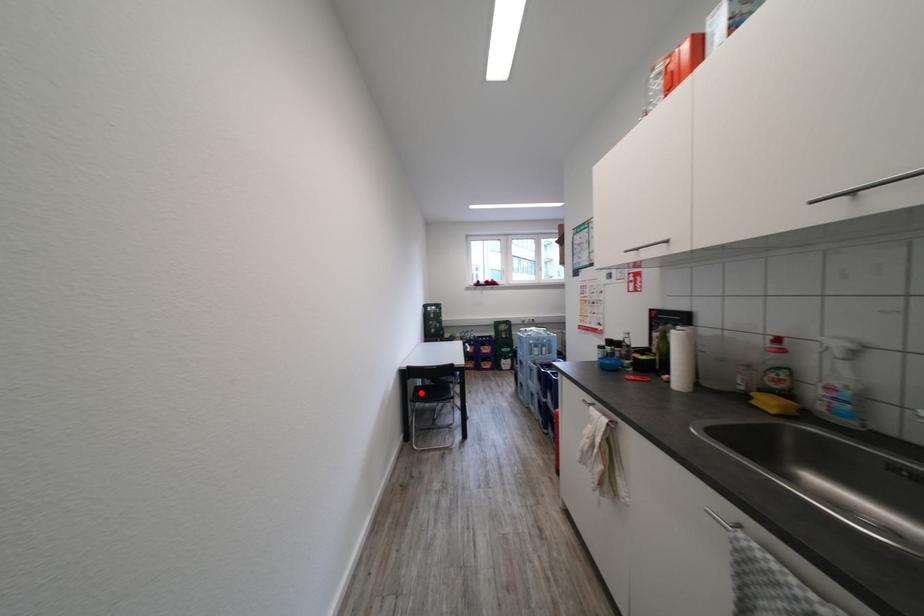
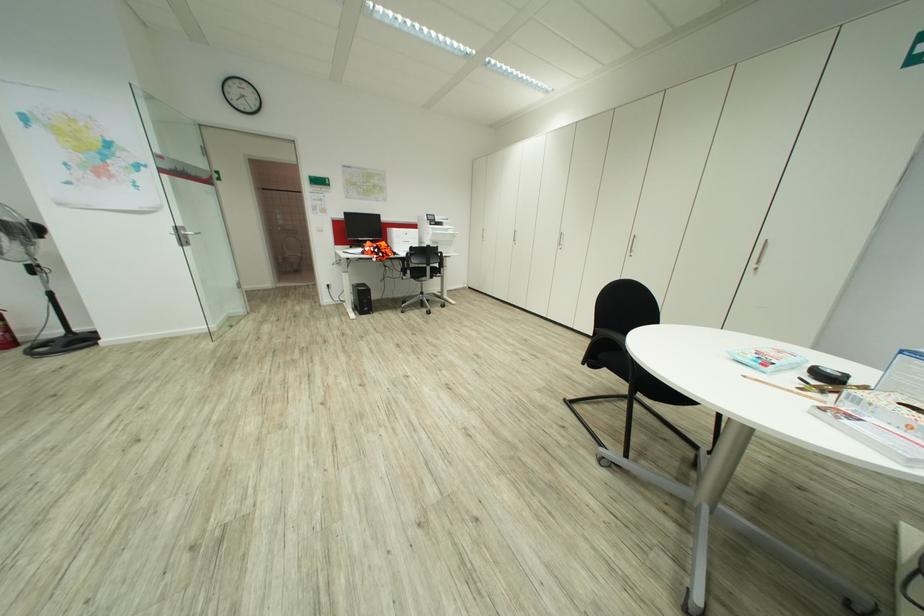
Question: I am providing you with two images of the same scene from different viewpoints. A red point is marked on the first image. At the location where the point appears in image 1, is it still visible in image 2?

Choices:
 (A) Yes
 (B) No

Answer: (B)